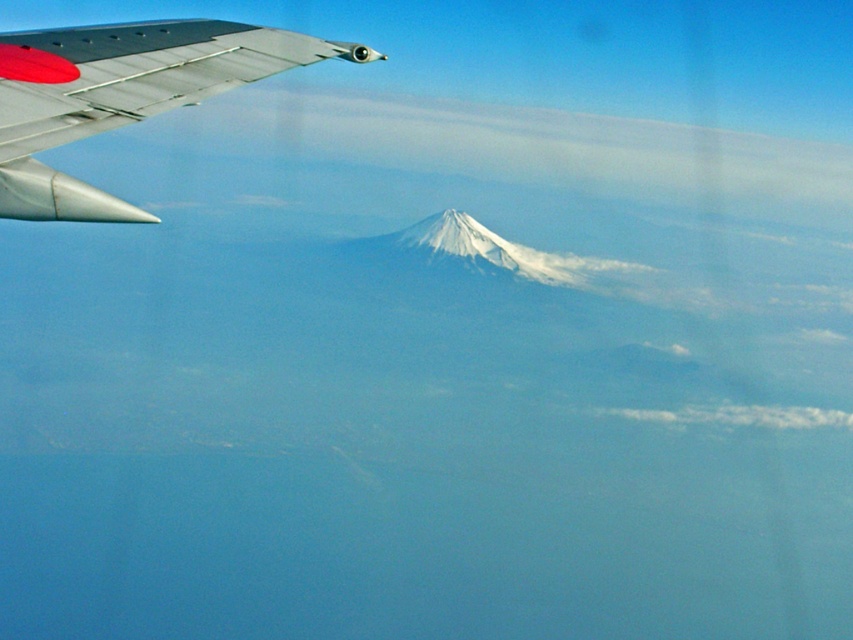
You are a passenger looking out the airplane window and see the metallic silver winglet at upper left and the white fluffy cloud at lower right. Which object appears taller in the image?

The white fluffy cloud at lower right appears taller because the metallic silver winglet at upper left is shorter than it.

You are a pilot flying at an altitude of 30,000 feet. You notice a point at coordinates (120, 93) on your window. Based on the scene description, what object is located at that point?

The point at coordinates (120, 93) indicates the metallic silver winglet at upper left.

You are a passenger sitting at the window seat of an airplane and see two points in the scene. The first point is at coordinate point(80,28) and the second is at point(735,424). Which point is closer to your eyes?

Point(80,28) is closer to the camera than point(735,424), so the first point is closer to your eyes.